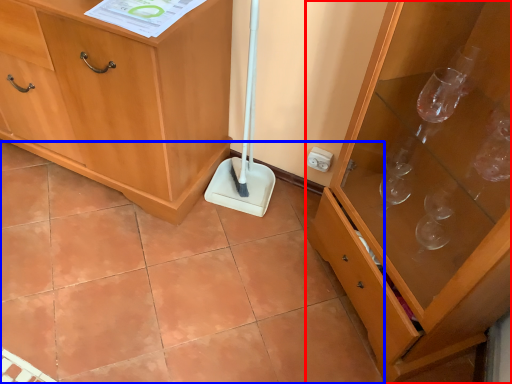
Question: Among these objects, which one is nearest to the camera, cabinetry (highlighted by a red box) or ceramic tile (highlighted by a blue box)?

Choices:
 (A) cabinetry
 (B) ceramic tile

Answer: (A)